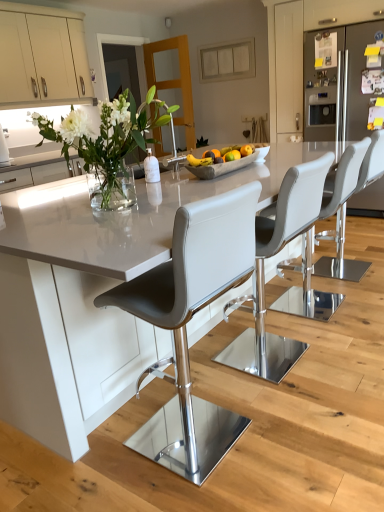
The width and height of the screenshot is (384, 512). In order to click on vacant space that is to the left of matte gray bar stool at center, positioned as the fourth chair in back-to-front order in this screenshot , I will do [97, 462].